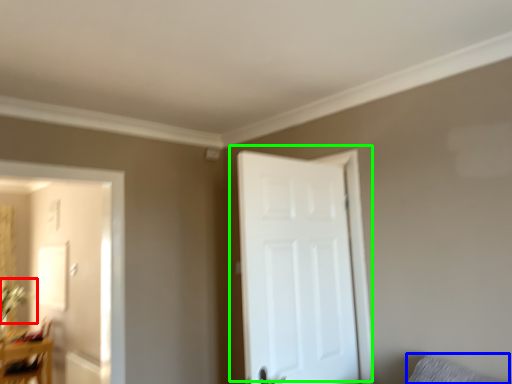
Question: Which object is the farthest from plant (highlighted by a red box)? Choose among these: pillow (highlighted by a blue box) or door (highlighted by a green box).

Choices:
 (A) pillow
 (B) door

Answer: (A)